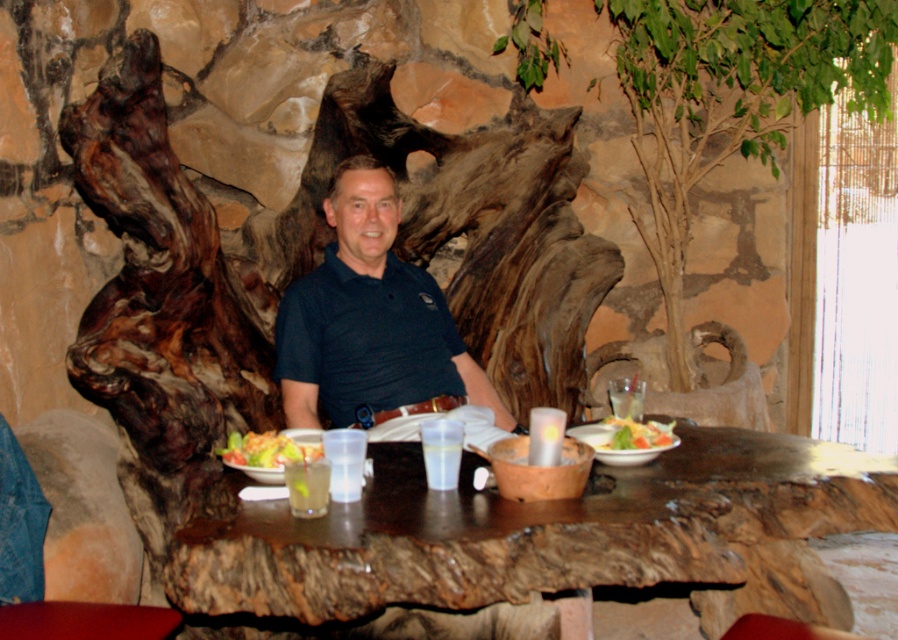
You are a waiter in a rustic restaurant with a wooden table made from a tree trunk. You need to place a new order of soup on the table. The table has a shiny plastic salad bowl at center. Where should you place the soup bowl so it doesn not interfere with the salad bowl?

The shiny plastic salad bowl at center is located at point [270,449]. To avoid interference, place the soup bowl away from this coordinate, ensuring sufficient space between them.

You are a server in a rustic restaurant and need to place a new menu on the table. The menu is 12 inches wide. Can you determine if the brown rough wood tree trunk at center has enough space to accommodate the menu without overlapping the shiny plastic salad bowl at center?

The brown rough wood tree trunk at center is wider than the shiny plastic salad bowl at center. Since the menu is 12 inches wide, and the tree trunk table is wider than the salad bowl, there should be enough space to place the menu on the table without overlapping the salad bowl.

You are a photographer standing in the dining area and want to take a closeup photo of the brown rough wood tree trunk at center. If your camera can focus on objects within 5 feet, will you be able to take the closeup?

The distance between the brown rough wood tree trunk at center and the camera is 7.34 feet, which is beyond the camera focus range of 5 feet. Therefore, you cannot take the closeup.